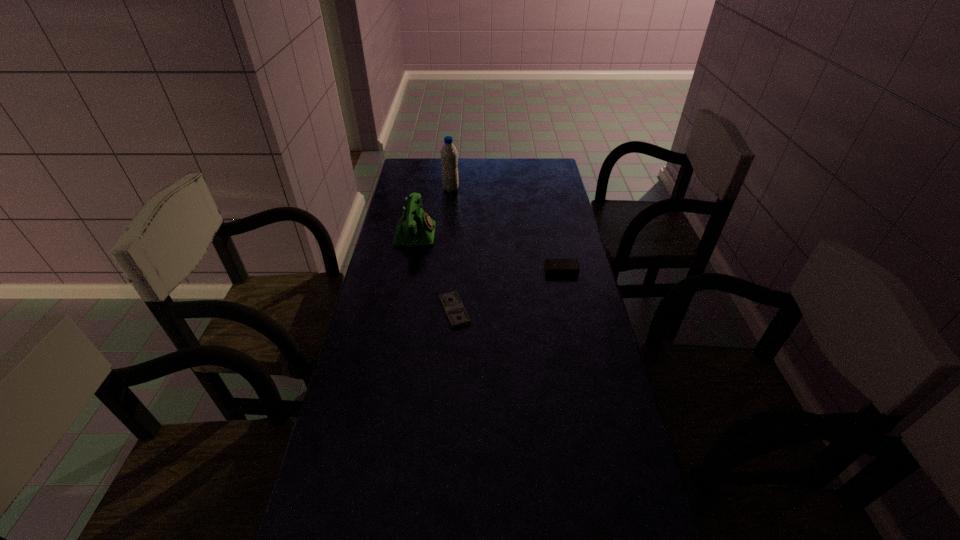
Where is `vacant space situated 0.330m on the front face of the second shortest object`? The height and width of the screenshot is (540, 960). vacant space situated 0.330m on the front face of the second shortest object is located at coordinates (579, 352).

In order to click on vacant space situated 0.220m on the left of the nearest object in this screenshot , I will do `click(369, 310)`.

This screenshot has width=960, height=540. I want to click on object that is at the left edge, so click(415, 228).

At what (x,y) coordinates should I click in order to perform the action: click on object that is positioned at the right edge. Please return your answer as a coordinate pair (x, y). This screenshot has height=540, width=960. Looking at the image, I should click on (553, 266).

Identify the location of vacant space at the far edge of the desktop. The height and width of the screenshot is (540, 960). (461, 162).

You are a GUI agent. You are given a task and a screenshot of the screen. Output one action in this format:
    pyautogui.click(x=<x>, y=<y>)
    Task: Click on the vacant space at the left edge of the desktop
    This screenshot has height=540, width=960.
    Given the screenshot: What is the action you would take?
    pyautogui.click(x=390, y=319)

Where is `free location at the right edge of the desktop`? The width and height of the screenshot is (960, 540). free location at the right edge of the desktop is located at coordinates (592, 336).

Identify the location of free space between the third nearest object and the alarm clock. This screenshot has width=960, height=540. (489, 252).

Locate an element on the screen. The width and height of the screenshot is (960, 540). free space between the rightmost object and the tallest object is located at coordinates (506, 230).

Locate an element on the screen. vacant region between the water bottle and the shortest object is located at coordinates (453, 250).